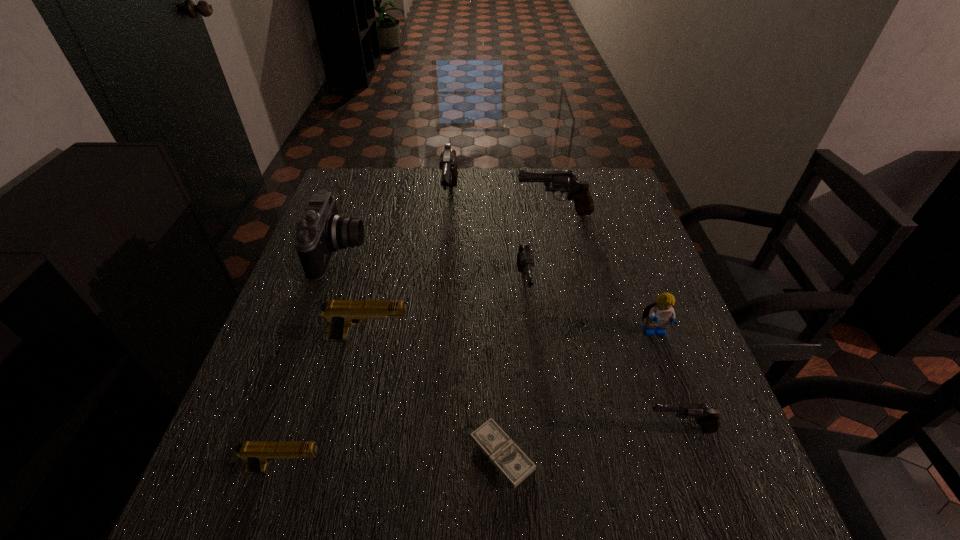
Where is `free space located on the front-facing side of the Lego`? The height and width of the screenshot is (540, 960). free space located on the front-facing side of the Lego is located at coordinates (705, 471).

You are a GUI agent. You are given a task and a screenshot of the screen. Output one action in this format:
    pyautogui.click(x=<x>, y=<y>)
    Task: Click on the vacant space located 0.130m at the barrel of the bigger tan pistol
    
    Given the screenshot: What is the action you would take?
    pyautogui.click(x=470, y=339)

This screenshot has height=540, width=960. I want to click on vacant space situated at the barrel of the smallest gray pistol, so click(512, 429).

Locate an element on the screen. The width and height of the screenshot is (960, 540). vacant area situated 0.200m at the barrel of the smallest gray pistol is located at coordinates (534, 429).

Where is `vacant space located 0.120m at the barrel of the smallest gray pistol`? vacant space located 0.120m at the barrel of the smallest gray pistol is located at coordinates (578, 429).

This screenshot has width=960, height=540. I want to click on vacant space located at the barrel of the nearest pistol, so click(508, 469).

You are a GUI agent. You are given a task and a screenshot of the screen. Output one action in this format:
    pyautogui.click(x=<x>, y=<y>)
    Task: Click on the vacant space located 0.080m on the back of the shortest object
    Image resolution: width=960 pixels, height=540 pixels.
    Given the screenshot: What is the action you would take?
    pyautogui.click(x=499, y=384)

You are a GUI agent. You are given a task and a screenshot of the screen. Output one action in this format:
    pyautogui.click(x=<x>, y=<y>)
    Task: Click on the object that is at the near edge
    The height and width of the screenshot is (540, 960).
    Given the screenshot: What is the action you would take?
    pyautogui.click(x=506, y=456)

You are a GUI agent. You are given a task and a screenshot of the screen. Output one action in this format:
    pyautogui.click(x=<x>, y=<y>)
    Task: Click on the camera that is at the left edge
    This screenshot has height=540, width=960.
    Given the screenshot: What is the action you would take?
    pyautogui.click(x=321, y=231)

The image size is (960, 540). In order to click on Lego at the right edge in this screenshot , I will do `click(659, 314)`.